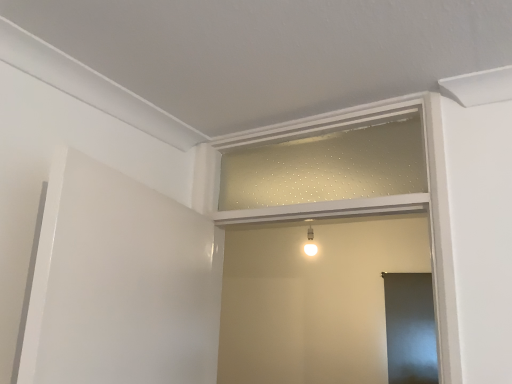
Question: Can you confirm if clear glass window frame at center, marked as the 1th window frame in a top-to-bottom arrangement, is thinner than white matte window frame at center, the first window frame ordered from the bottom?

Choices:
 (A) no
 (B) yes

Answer: (B)

Question: From the image's perspective, is clear glass window frame at center, marked as the 1th window frame in a top-to-bottom arrangement, on white matte window frame at center, which is the 2th window frame from top to bottom?

Choices:
 (A) no
 (B) yes

Answer: (B)

Question: From a real-world perspective, does clear glass window frame at center, the 2th window frame from the bottom, sit lower than white matte window frame at center, which is the 2th window frame from top to bottom?

Choices:
 (A) yes
 (B) no

Answer: (B)

Question: From a real-world perspective, is clear glass window frame at center, marked as the 1th window frame in a top-to-bottom arrangement, positioned over white matte window frame at center, which is the 2th window frame from top to bottom, based on gravity?

Choices:
 (A) no
 (B) yes

Answer: (B)

Question: Is clear glass window frame at center, marked as the 1th window frame in a top-to-bottom arrangement, beside white matte window frame at center, which is the 2th window frame from top to bottom?

Choices:
 (A) yes
 (B) no

Answer: (B)

Question: Based on their sizes in the image, would you say white matte window frame at center, the first window frame ordered from the bottom, is bigger or smaller than clear glass window frame at center, the 2th window frame from the bottom?

Choices:
 (A) big
 (B) small

Answer: (A)

Question: From a real-world perspective, is white matte window frame at center, the first window frame ordered from the bottom, positioned above or below clear glass window frame at center, the 2th window frame from the bottom?

Choices:
 (A) above
 (B) below

Answer: (B)

Question: Is white matte window frame at center, the first window frame ordered from the bottom, inside the boundaries of clear glass window frame at center, marked as the 1th window frame in a top-to-bottom arrangement, or outside?

Choices:
 (A) outside
 (B) inside

Answer: (A)

Question: Does point (442, 344) appear closer or farther from the camera than point (271, 195)?

Choices:
 (A) closer
 (B) farther

Answer: (A)

Question: Is matte gray screen door at lower right spatially inside clear glass window frame at center, the 2th window frame from the bottom, or outside of it?

Choices:
 (A) outside
 (B) inside

Answer: (A)

Question: From their relative heights in the image, would you say matte gray screen door at lower right is taller or shorter than clear glass window frame at center, marked as the 1th window frame in a top-to-bottom arrangement?

Choices:
 (A) tall
 (B) short

Answer: (A)

Question: Does point (389, 334) appear closer or farther from the camera than point (230, 167)?

Choices:
 (A) closer
 (B) farther

Answer: (B)

Question: Considering their positions, is matte gray screen door at lower right located in front of or behind clear glass window frame at center, marked as the 1th window frame in a top-to-bottom arrangement?

Choices:
 (A) behind
 (B) front

Answer: (A)

Question: Is white matte window frame at center, the first window frame ordered from the bottom, taller or shorter than matte gray screen door at lower right?

Choices:
 (A) tall
 (B) short

Answer: (A)

Question: In the image, is white matte window frame at center, which is the 2th window frame from top to bottom, positioned in front of or behind matte gray screen door at lower right?

Choices:
 (A) front
 (B) behind

Answer: (A)